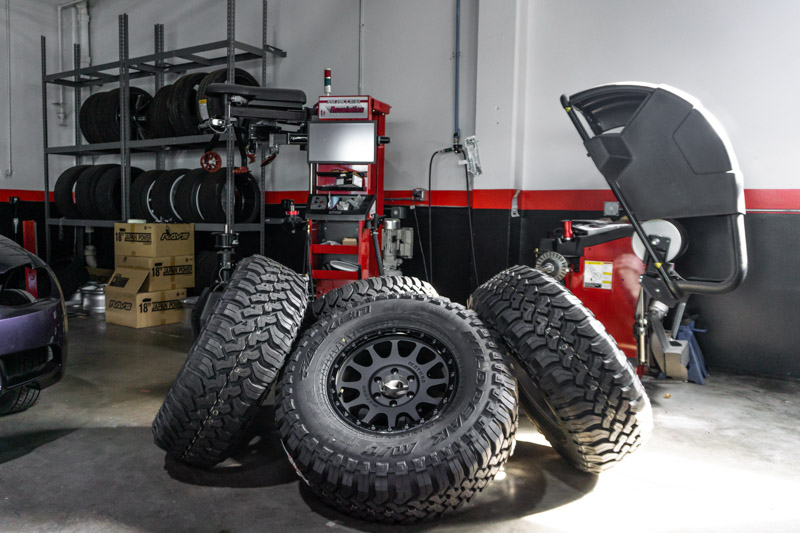
Locate an element on the screen. The width and height of the screenshot is (800, 533). floor is located at coordinates (100, 463), (718, 461).